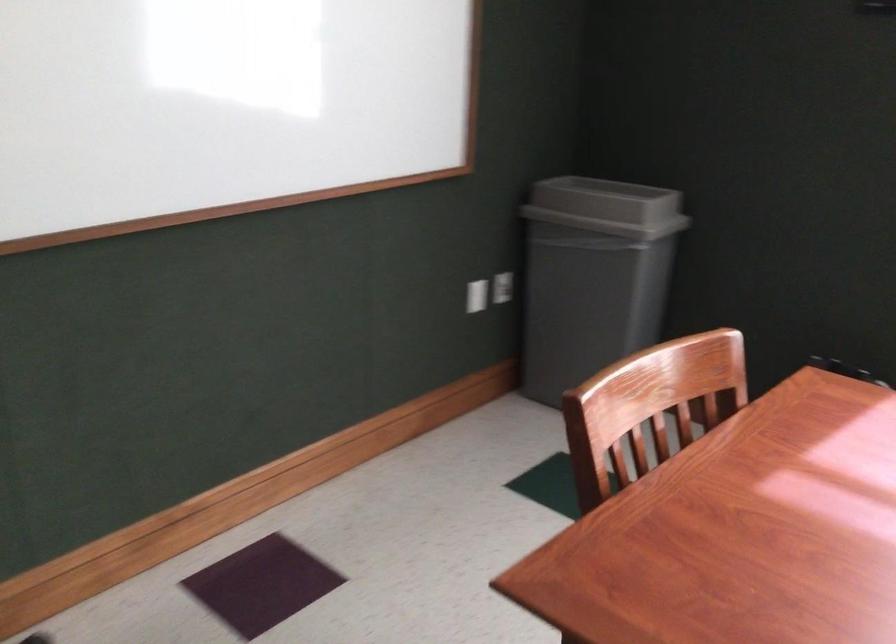
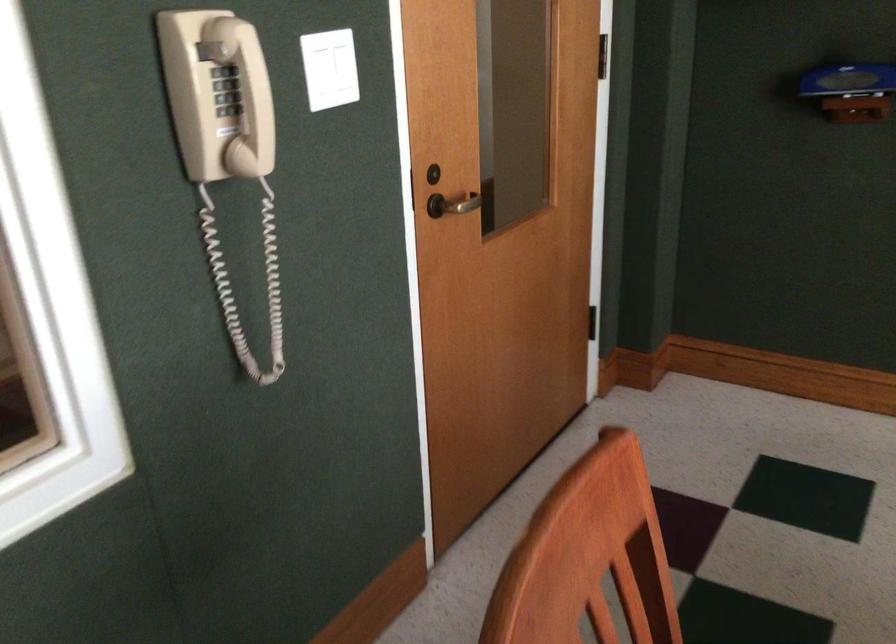
How did the camera likely rotate?

The camera rotated toward left-down.